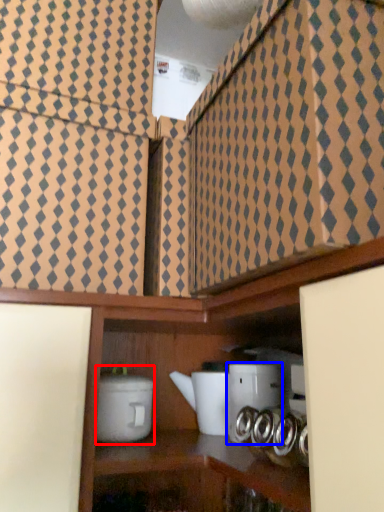
Question: Which point is closer to the camera, appliance (highlighted by a red box) or appliance (highlighted by a blue box)?

Choices:
 (A) appliance
 (B) appliance

Answer: (A)